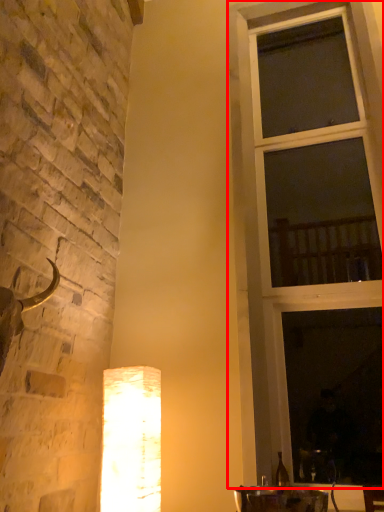
Question: From the image's perspective, what is the correct spatial relationship of window (annotated by the red box) in relation to lamp?

Choices:
 (A) above
 (B) below

Answer: (A)